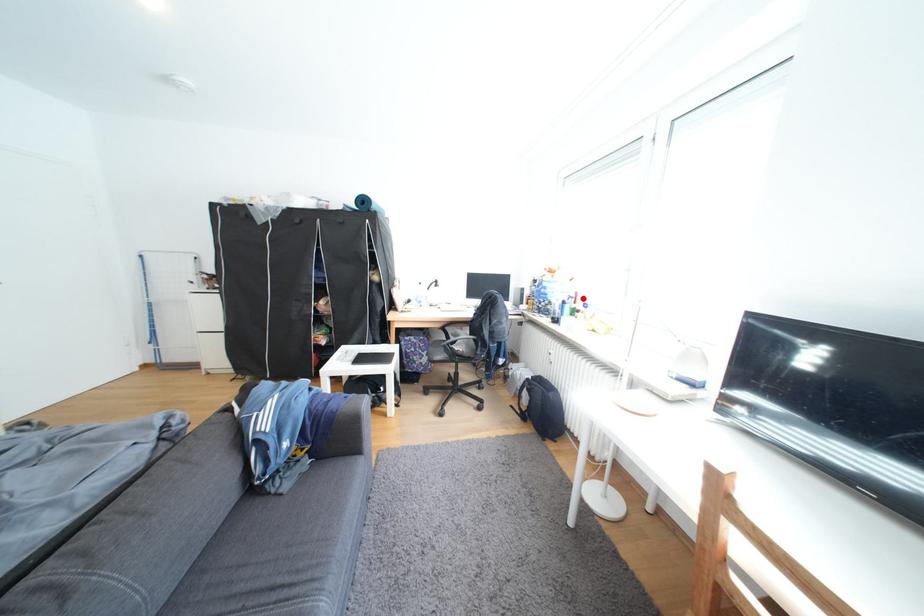
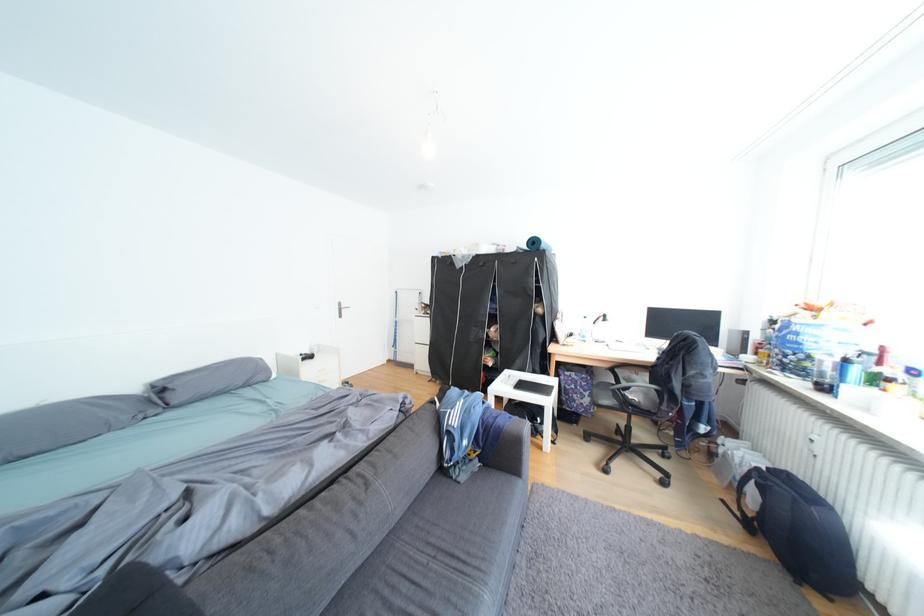
In the second image, find the point that corresponds to the highlighted location in the first image.

(878, 355)